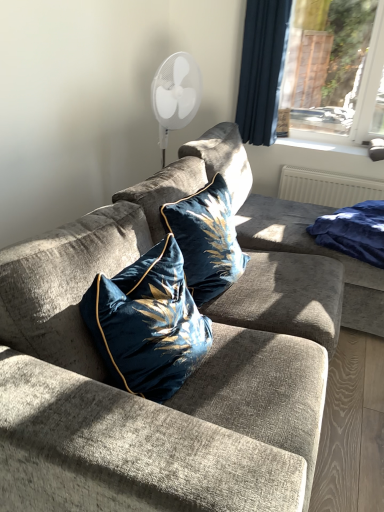
You are a GUI agent. You are given a task and a screenshot of the screen. Output one action in this format:
    pyautogui.click(x=<x>, y=<y>)
    Task: Click on the velvet fabric couch at center
    
    Given the screenshot: What is the action you would take?
    pyautogui.click(x=184, y=384)

What do you see at coordinates (184, 384) in the screenshot? The image size is (384, 512). I see `velvet fabric couch at center` at bounding box center [184, 384].

The image size is (384, 512). Describe the element at coordinates (354, 231) in the screenshot. I see `blue velvet blanket at right` at that location.

Consider the image. How much space does velvet blue pillow at center, positioned as the 2th pillow in back-to-front order, occupy vertically?

velvet blue pillow at center, positioned as the 2th pillow in back-to-front order, is 17.98 inches in height.

The height and width of the screenshot is (512, 384). I want to click on velvet blue pillow at center, arranged as the 1th pillow when viewed from the front, so click(x=148, y=323).

Image resolution: width=384 pixels, height=512 pixels. What do you see at coordinates (262, 69) in the screenshot?
I see `dark blue velvet curtain at upper right` at bounding box center [262, 69].

Locate an element on the screen. The height and width of the screenshot is (512, 384). dark blue velvet curtain at upper right is located at coordinates coord(262,69).

The height and width of the screenshot is (512, 384). I want to click on velvet blue pillow at center, which is counted as the 1th pillow, starting from the back, so click(206, 240).

The height and width of the screenshot is (512, 384). Describe the element at coordinates (324, 145) in the screenshot. I see `white plastic window sill at upper right` at that location.

Where is `velvet fabric couch at center`? velvet fabric couch at center is located at coordinates (184, 384).

Which object is further away from the camera, dark blue velvet curtain at upper right or white plastic window sill at upper right?

white plastic window sill at upper right is further from the camera.

From the image's perspective, would you say dark blue velvet curtain at upper right is positioned over white plastic window sill at upper right?

Correct, dark blue velvet curtain at upper right appears higher than white plastic window sill at upper right in the image.

Is dark blue velvet curtain at upper right to the right of velvet blue pillow at center, arranged as the 1th pillow when viewed from the front, from the viewer's perspective?

Yes, dark blue velvet curtain at upper right is to the right of velvet blue pillow at center, arranged as the 1th pillow when viewed from the front.

Are dark blue velvet curtain at upper right and velvet blue pillow at center, arranged as the 1th pillow when viewed from the front, far apart?

Absolutely, dark blue velvet curtain at upper right is distant from velvet blue pillow at center, arranged as the 1th pillow when viewed from the front.

Which is less distant, (257, 93) or (131, 318)?

The point (131, 318) is closer to the camera.

In the scene shown: Is white plastic window sill at upper right facing away from velvet blue pillow at center, which is the 2th pillow from front to back?

No, velvet blue pillow at center, which is the 2th pillow from front to back, is not at the back of white plastic window sill at upper right.

Is point (363, 149) behind point (220, 258)?

That is True.

Would you say white plastic window sill at upper right contains velvet blue pillow at center, which is the 2th pillow from front to back?

No, white plastic window sill at upper right does not contain velvet blue pillow at center, which is the 2th pillow from front to back.

From the image's perspective, is white plastic window sill at upper right above velvet blue pillow at center, which is counted as the 1th pillow, starting from the back?

Yes, from the image's perspective, white plastic window sill at upper right is above velvet blue pillow at center, which is counted as the 1th pillow, starting from the back.

Which is less distant, (207, 197) or (369, 213)?

Point (207, 197)

Between velvet blue pillow at center, which is counted as the 1th pillow, starting from the back, and blue velvet blanket at right, which one has more height?

With more height is velvet blue pillow at center, which is counted as the 1th pillow, starting from the back.

Does velvet blue pillow at center, which is counted as the 1th pillow, starting from the back, turn towards blue velvet blanket at right?

No.

In the scene shown: Which is behind, velvet fabric couch at center or dark blue velvet curtain at upper right?

dark blue velvet curtain at upper right is behind.

In terms of height, does velvet fabric couch at center look taller or shorter compared to dark blue velvet curtain at upper right?

In the image, velvet fabric couch at center appears to be shorter than dark blue velvet curtain at upper right.

Choose the correct answer: Is velvet fabric couch at center inside dark blue velvet curtain at upper right or outside it?

velvet fabric couch at center is outside dark blue velvet curtain at upper right.

In terms of size, does velvet fabric couch at center appear bigger or smaller than dark blue velvet curtain at upper right?

In the image, velvet fabric couch at center appears to be larger than dark blue velvet curtain at upper right.

How far apart are blue velvet blanket at right and velvet blue pillow at center, which is counted as the 1th pillow, starting from the back?

blue velvet blanket at right is 24.97 inches away from velvet blue pillow at center, which is counted as the 1th pillow, starting from the back.

From the picture: Can you confirm if blue velvet blanket at right is positioned to the right of velvet blue pillow at center, which is the 2th pillow from front to back?

Correct, you'll find blue velvet blanket at right to the right of velvet blue pillow at center, which is the 2th pillow from front to back.

Considering the sizes of objects blue velvet blanket at right and velvet blue pillow at center, which is counted as the 1th pillow, starting from the back, in the image provided, who is bigger, blue velvet blanket at right or velvet blue pillow at center, which is counted as the 1th pillow, starting from the back,?

Bigger between the two is velvet blue pillow at center, which is counted as the 1th pillow, starting from the back.

Which object is further away from the camera, blue velvet blanket at right or velvet blue pillow at center, which is the 2th pillow from front to back?

blue velvet blanket at right is further away from the camera.

Considering the positions of objects blue velvet blanket at right and dark blue velvet curtain at upper right in the image provided, who is more to the right, blue velvet blanket at right or dark blue velvet curtain at upper right?

From the viewer's perspective, blue velvet blanket at right appears more on the right side.

From a real-world perspective, is blue velvet blanket at right beneath dark blue velvet curtain at upper right?

Correct, in the physical world, blue velvet blanket at right is lower than dark blue velvet curtain at upper right.

Is point (350, 250) farther from camera compared to point (252, 71)?

No, it is not.

Where is `curtain lying above the white plastic window sill at upper right (from the image's perspective)`? curtain lying above the white plastic window sill at upper right (from the image's perspective) is located at coordinates (262, 69).

From a real-world perspective, count 2nd pillows downward from the dark blue velvet curtain at upper right and point to it. Please provide its 2D coordinates.

[(148, 323)]

Considering their positions, is white plastic window sill at upper right positioned further to velvet blue pillow at center, positioned as the 2th pillow in back-to-front order, than velvet blue pillow at center, which is the 2th pillow from front to back?

white plastic window sill at upper right lies further to velvet blue pillow at center, positioned as the 2th pillow in back-to-front order, than the other object.

Looking at the image, which one is located closer to velvet blue pillow at center, arranged as the 1th pillow when viewed from the front, velvet blue pillow at center, which is counted as the 1th pillow, starting from the back, or white plastic window sill at upper right?

Among the two, velvet blue pillow at center, which is counted as the 1th pillow, starting from the back, is located nearer to velvet blue pillow at center, arranged as the 1th pillow when viewed from the front.

From the image, which object appears to be nearer to velvet blue pillow at center, which is counted as the 1th pillow, starting from the back, white plastic window sill at upper right or velvet blue pillow at center, positioned as the 2th pillow in back-to-front order?

velvet blue pillow at center, positioned as the 2th pillow in back-to-front order.

Which object lies nearer to the anchor point dark blue velvet curtain at upper right, blue velvet blanket at right or velvet blue pillow at center, arranged as the 1th pillow when viewed from the front?

The object closer to dark blue velvet curtain at upper right is blue velvet blanket at right.

Which object lies further to the anchor point velvet fabric couch at center, velvet blue pillow at center, which is counted as the 1th pillow, starting from the back, or velvet blue pillow at center, positioned as the 2th pillow in back-to-front order?

The object further to velvet fabric couch at center is velvet blue pillow at center, which is counted as the 1th pillow, starting from the back.

From the image, which object appears to be farther from velvet blue pillow at center, positioned as the 2th pillow in back-to-front order, velvet fabric couch at center or blue velvet blanket at right?

blue velvet blanket at right is further to velvet blue pillow at center, positioned as the 2th pillow in back-to-front order.

Based on their spatial positions, is dark blue velvet curtain at upper right or velvet fabric couch at center further from velvet blue pillow at center, positioned as the 2th pillow in back-to-front order?

Based on the image, dark blue velvet curtain at upper right appears to be further to velvet blue pillow at center, positioned as the 2th pillow in back-to-front order.

Which object lies further to the anchor point blue velvet blanket at right, velvet fabric couch at center or white plastic window sill at upper right?

white plastic window sill at upper right is positioned further to the anchor blue velvet blanket at right.

Locate an element on the screen. pillow between velvet blue pillow at center, arranged as the 1th pillow when viewed from the front, and dark blue velvet curtain at upper right in the front-back direction is located at coordinates (206, 240).

Where is `material between velvet blue pillow at center, positioned as the 2th pillow in back-to-front order, and dark blue velvet curtain at upper right in the front-back direction`? This screenshot has width=384, height=512. material between velvet blue pillow at center, positioned as the 2th pillow in back-to-front order, and dark blue velvet curtain at upper right in the front-back direction is located at coordinates (354, 231).

Image resolution: width=384 pixels, height=512 pixels. Find the location of `material positioned between velvet fabric couch at center and dark blue velvet curtain at upper right from near to far`. material positioned between velvet fabric couch at center and dark blue velvet curtain at upper right from near to far is located at coordinates (354, 231).

Locate an element on the screen. pillow located between velvet fabric couch at center and velvet blue pillow at center, which is the 2th pillow from front to back, in the depth direction is located at coordinates (148, 323).